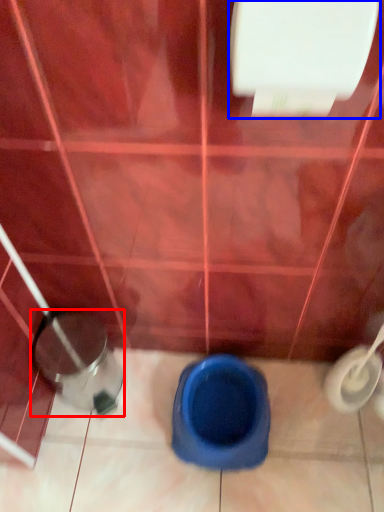
Question: Among these objects, which one is nearest to the camera, potty (highlighted by a red box) or toilet paper (highlighted by a blue box)?

Choices:
 (A) potty
 (B) toilet paper

Answer: (B)